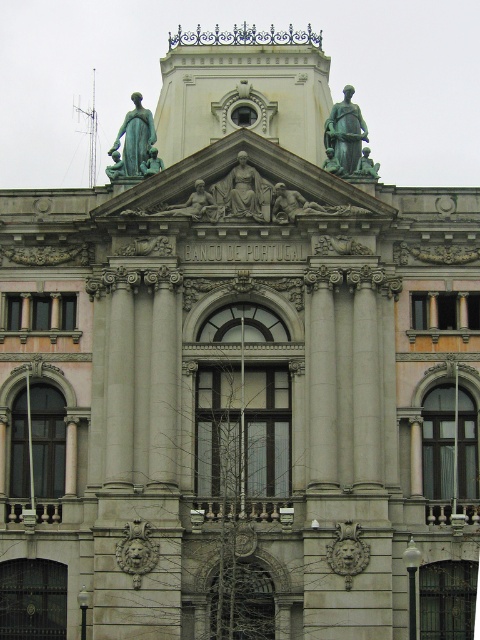
Which is more to the right, green patina statue at upper center or matte gray stone statue at center?

Positioned to the right is matte gray stone statue at center.

Does green patina statue at upper center appear under matte gray stone statue at center?

Incorrect, green patina statue at upper center is not positioned below matte gray stone statue at center.

Is point (146, 154) positioned after point (236, 180)?

Yes, point (146, 154) is behind point (236, 180).

Identify the location of green patina statue at upper center. This screenshot has height=640, width=480. (134, 145).